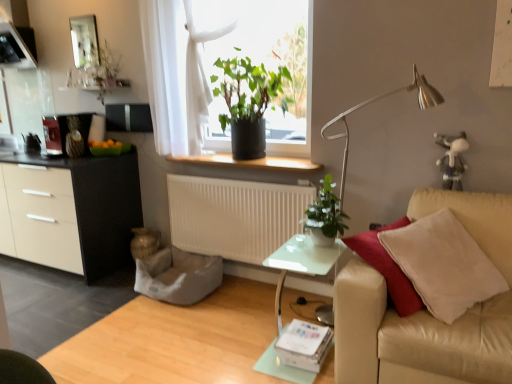
Find the location of a particular element. This screenshot has height=384, width=512. free space to the right of gray fabric swivel chair at lower center is located at coordinates (244, 298).